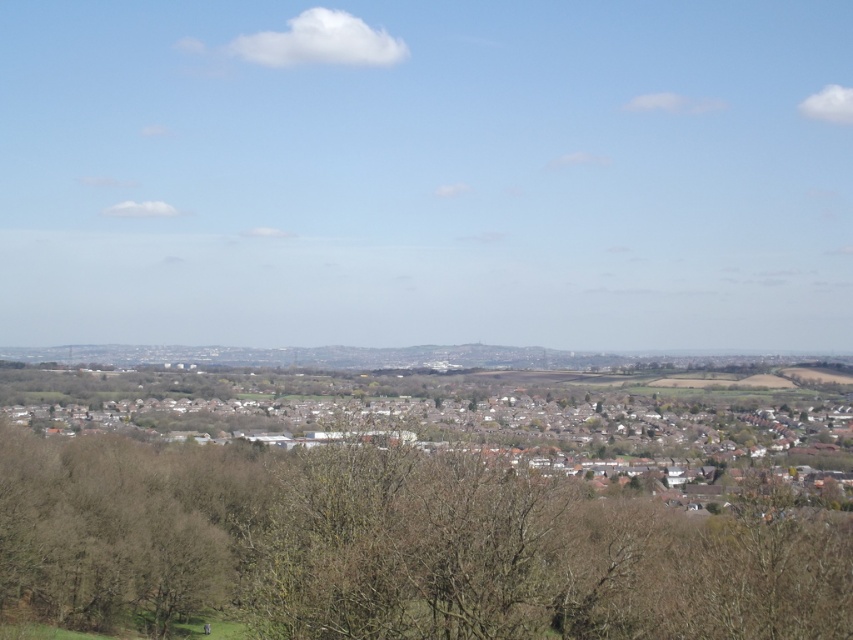
You are a city planner analyzing the urban layout. You notice the brown leafless tree at lower center and the brown wooden houses at center. Which of these two has a smaller width?

The brown leafless tree at lower center has a lesser width compared to the brown wooden houses at center.

You are standing at the edge of the urban landscape and notice the brown leafless tree at lower center and the brown wooden houses at center. Which object appears taller from your vantage point?

The brown leafless tree at lower center is taller than the brown wooden houses at center, so it appears taller from your vantage point.